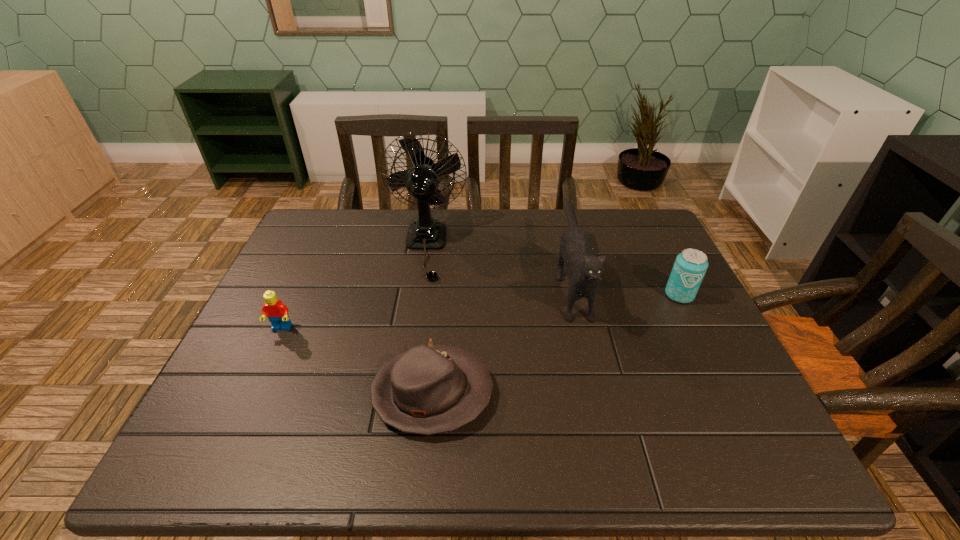
This screenshot has height=540, width=960. In order to click on fan in this screenshot , I will do `click(427, 233)`.

At what (x,y) coordinates should I click in order to perform the action: click on the fourth shortest object. Please return your answer as a coordinate pair (x, y). This screenshot has width=960, height=540. Looking at the image, I should click on (585, 269).

Where is `cat`? This screenshot has width=960, height=540. cat is located at coordinates (585, 269).

The height and width of the screenshot is (540, 960). What are the coordinates of `beer can` in the screenshot? It's located at (690, 266).

What are the coordinates of `Lego` in the screenshot? It's located at (277, 312).

The image size is (960, 540). What are the coordinates of `the shortest object` in the screenshot? It's located at (427, 390).

Where is `hat`? hat is located at coordinates (427, 390).

The image size is (960, 540). Find the location of `vacant space situated 0.300m in front of the tallest object, indicating the direction of air flow`. vacant space situated 0.300m in front of the tallest object, indicating the direction of air flow is located at coordinates (406, 373).

At what (x,y) coordinates should I click in order to perform the action: click on vacant space located on the front-facing side of the cat. Please return your answer as a coordinate pair (x, y). The image size is (960, 540). Looking at the image, I should click on (588, 359).

Where is `free space located 0.320m on the back of the rightmost object`? free space located 0.320m on the back of the rightmost object is located at coordinates (642, 219).